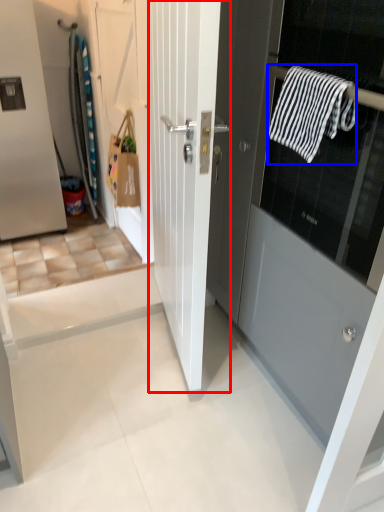
Question: Which object is further to the camera taking this photo, door (highlighted by a red box) or bath towel (highlighted by a blue box)?

Choices:
 (A) door
 (B) bath towel

Answer: (B)